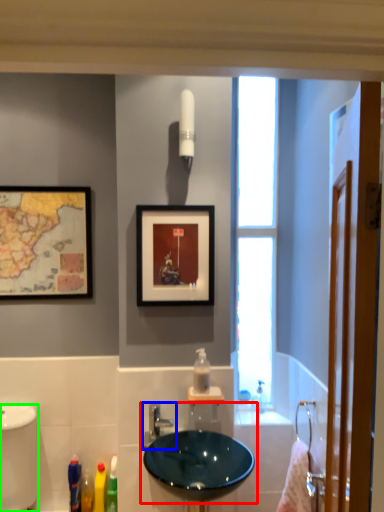
Question: Based on their relative distances, which object is farther from sink (highlighted by a red box)? Choose from tap (highlighted by a blue box) and bidet (highlighted by a green box).

Choices:
 (A) tap
 (B) bidet

Answer: (B)